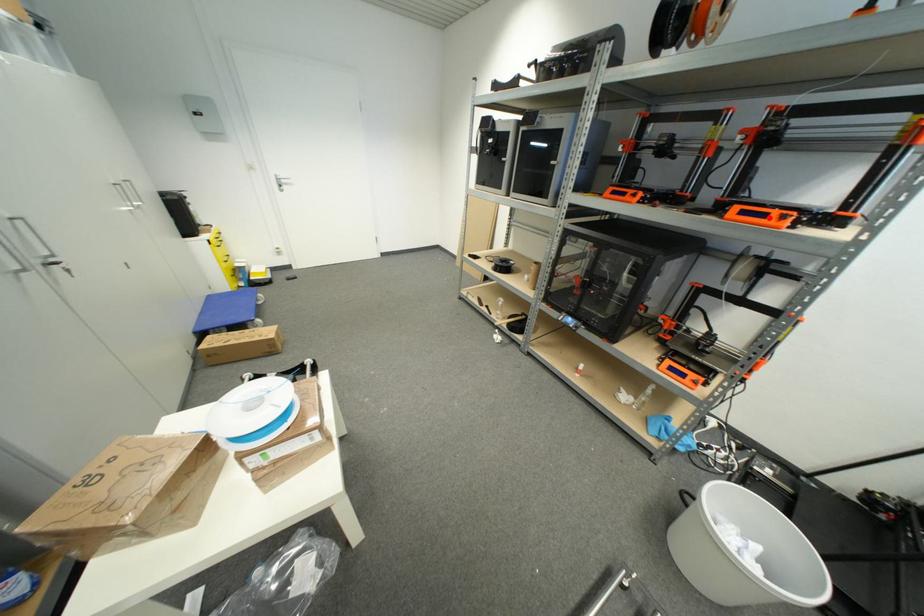
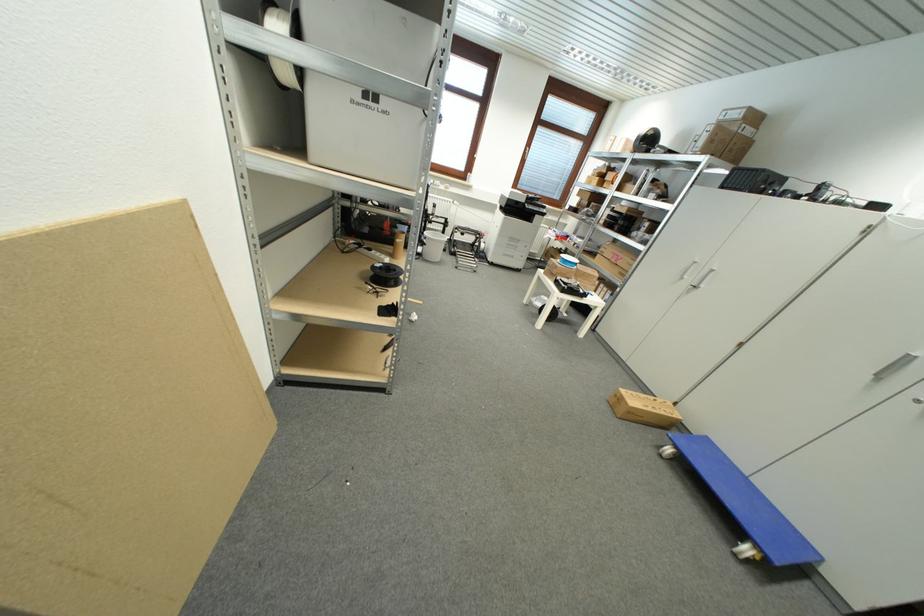
Question: I am providing you with two images of the same scene from different viewpoints. A red point is marked on the first image. Can you still see the location of the red point in image 2?

Choices:
 (A) Yes
 (B) No

Answer: (B)